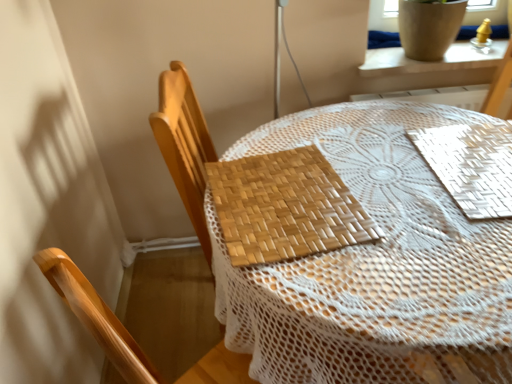
Question: Can you confirm if bamboo placemat at center is positioned to the left of woven wood chair at center?

Choices:
 (A) yes
 (B) no

Answer: (B)

Question: Does bamboo placemat at center have a lesser width compared to woven wood chair at center?

Choices:
 (A) yes
 (B) no

Answer: (B)

Question: Does bamboo placemat at center have a larger size compared to woven wood chair at center?

Choices:
 (A) yes
 (B) no

Answer: (A)

Question: From a real-world perspective, is bamboo placemat at center on woven wood chair at center?

Choices:
 (A) no
 (B) yes

Answer: (A)

Question: Is bamboo placemat at center oriented away from woven wood chair at center?

Choices:
 (A) no
 (B) yes

Answer: (A)

Question: Can you confirm if bamboo placemat at center is taller than woven wood chair at center?

Choices:
 (A) no
 (B) yes

Answer: (B)

Question: From a real-world perspective, is woven wood placemat at center, the 2th mat positioned from the right, located higher than white woven mat at upper right, arranged as the first mat when viewed from the right?

Choices:
 (A) yes
 (B) no

Answer: (A)

Question: Is woven wood placemat at center, marked as the first mat in a left-to-right arrangement, positioned far away from white woven mat at upper right, arranged as the second mat when viewed from the left?

Choices:
 (A) yes
 (B) no

Answer: (B)

Question: Does woven wood placemat at center, the 2th mat positioned from the right, have a greater width compared to white woven mat at upper right, arranged as the first mat when viewed from the right?

Choices:
 (A) no
 (B) yes

Answer: (A)

Question: Could you tell me if woven wood placemat at center, marked as the first mat in a left-to-right arrangement, is turned towards white woven mat at upper right, arranged as the first mat when viewed from the right?

Choices:
 (A) no
 (B) yes

Answer: (B)

Question: From a real-world perspective, is woven wood placemat at center, marked as the first mat in a left-to-right arrangement, physically below white woven mat at upper right, arranged as the second mat when viewed from the left?

Choices:
 (A) no
 (B) yes

Answer: (A)

Question: From the image's perspective, is woven wood placemat at center, the 2th mat positioned from the right, under white woven mat at upper right, arranged as the second mat when viewed from the left?

Choices:
 (A) no
 (B) yes

Answer: (B)

Question: Is white ceramic pot at upper right facing away from woven wood placemat at center, the 2th mat positioned from the right?

Choices:
 (A) yes
 (B) no

Answer: (B)